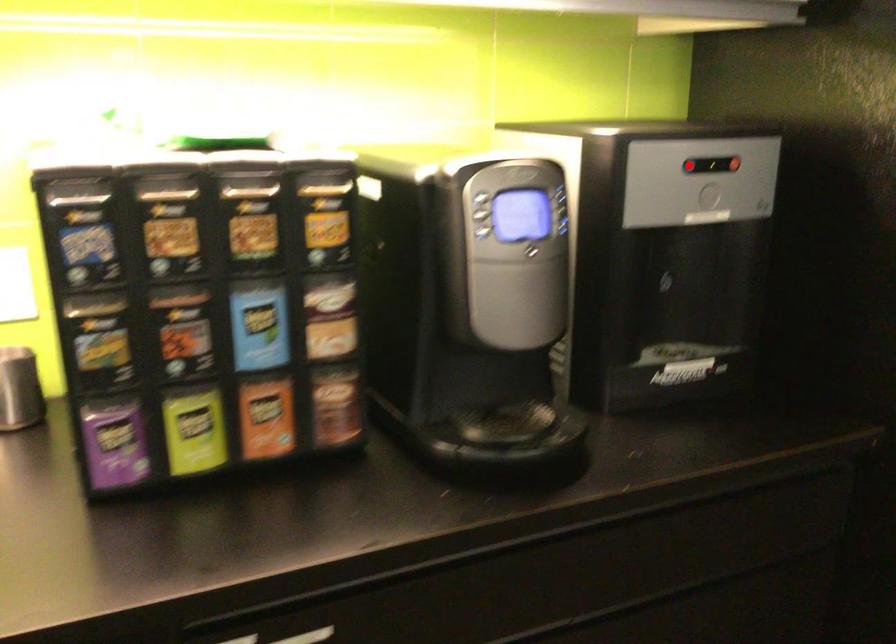
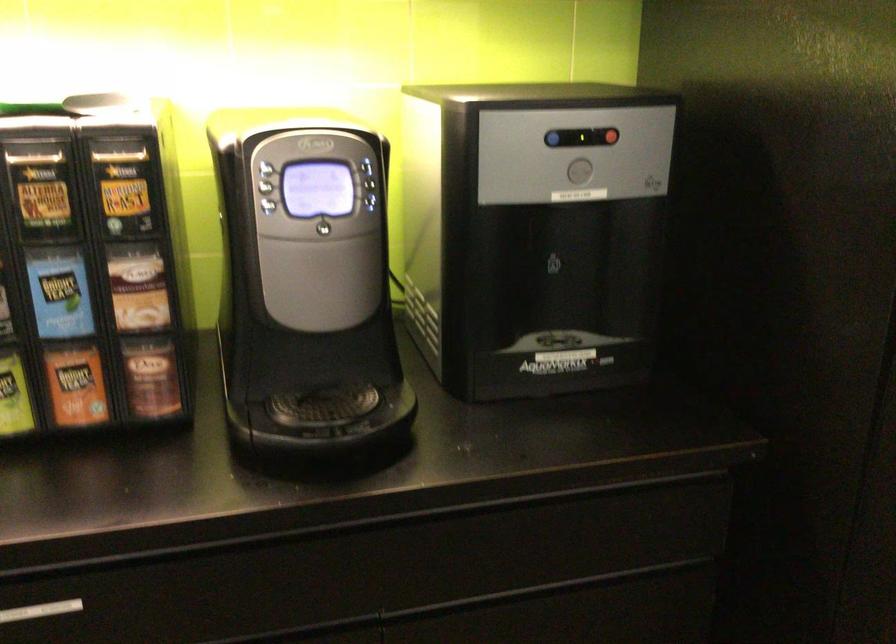
In the second image, find the point that corresponds to the highlighted location in the first image.

(552, 138)